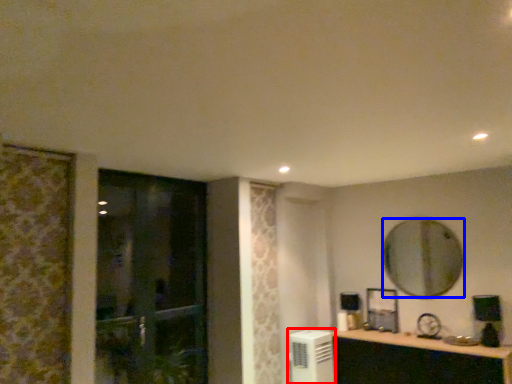
Question: Among these objects, which one is nearest to the camera, air conditioner (highlighted by a red box) or mirror (highlighted by a blue box)?

Choices:
 (A) air conditioner
 (B) mirror

Answer: (B)